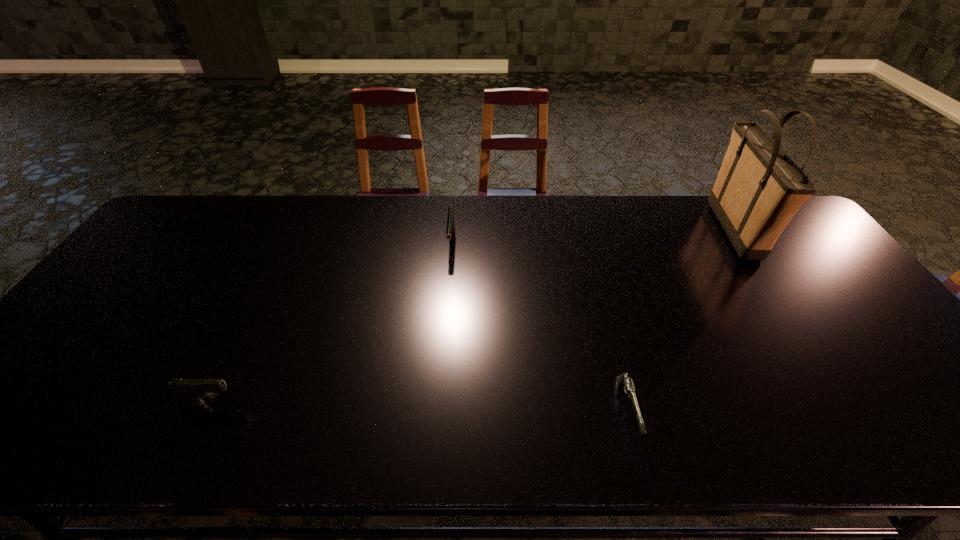
Locate an element on the screen. The width and height of the screenshot is (960, 540). pistol that stands as the closest to the shortest pistol is located at coordinates (450, 229).

Locate which pistol ranks in proximity to the farthest pistol. Please provide its 2D coordinates. Your answer should be formatted as a tuple, i.e. [(x, y)], where the tuple contains the x and y coordinates of a point satisfying the conditions above.

[(625, 380)]

This screenshot has width=960, height=540. In order to click on blank space that satisfies the following two spatial constraints: 1. at the muzzle of the second object from left to right; 2. at the barrel of the leftmost pistol in this screenshot , I will do `click(440, 403)`.

Where is `vacant space that satisfies the following two spatial constraints: 1. on the front side of the shopping bag; 2. at the barrel of the leftmost pistol`? This screenshot has width=960, height=540. vacant space that satisfies the following two spatial constraints: 1. on the front side of the shopping bag; 2. at the barrel of the leftmost pistol is located at coordinates (849, 403).